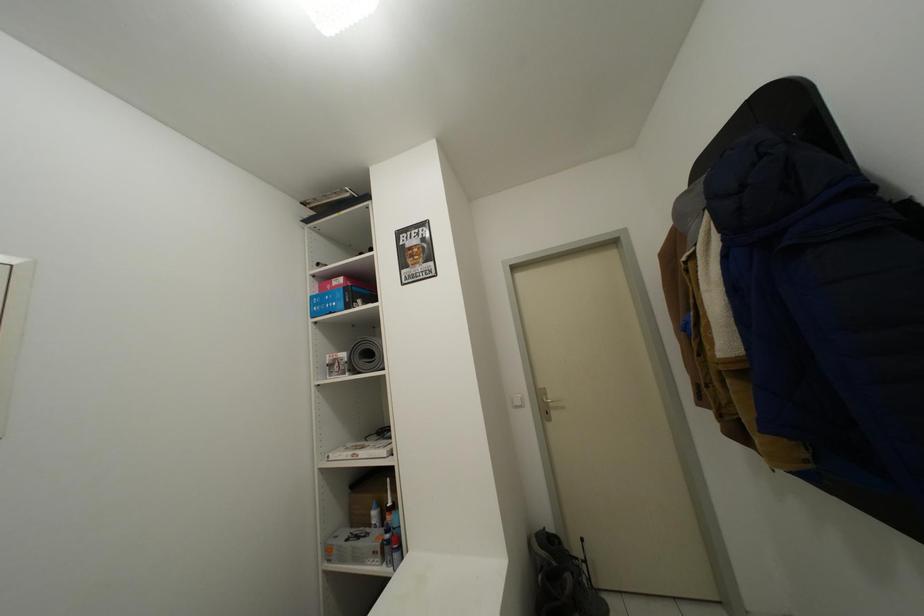
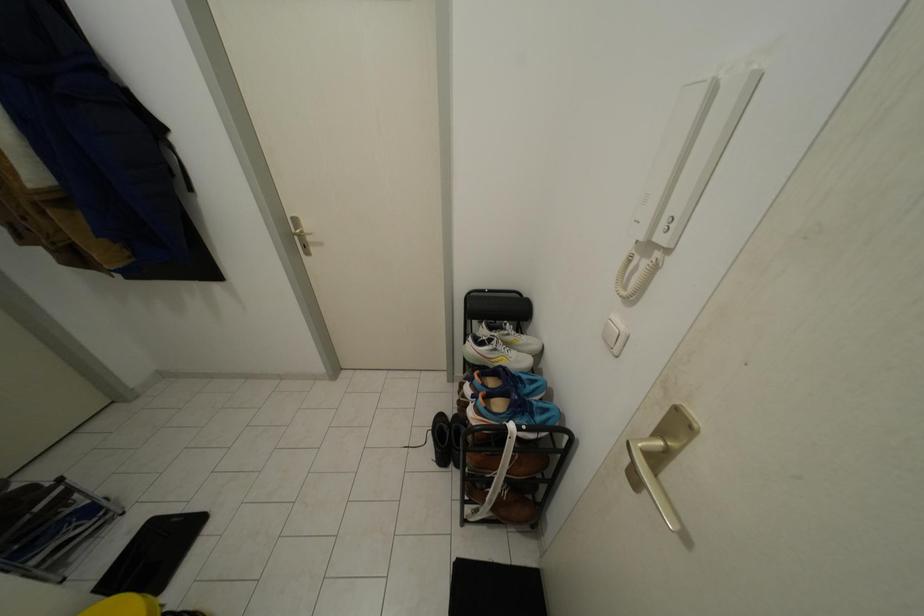
Based on the continuous images, in which direction is the camera rotating?

The camera rotated toward right-down.